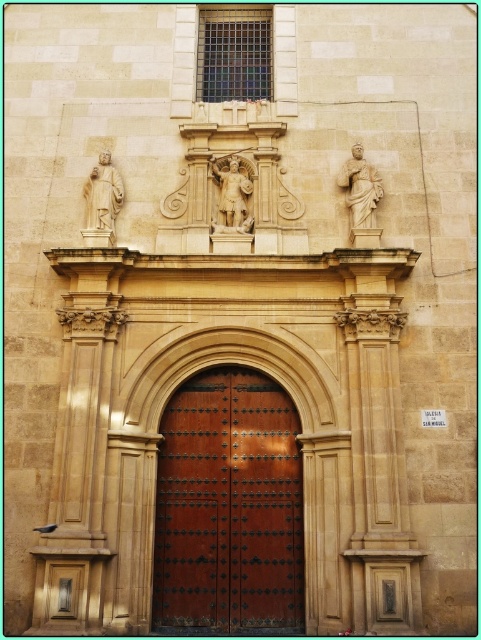
Question: Is brown wooden door at center to the right of light brown stone statue at center from the viewer's perspective?

Choices:
 (A) yes
 (B) no

Answer: (B)

Question: Is brown wooden door at center wider than light brown stone statue at center?

Choices:
 (A) yes
 (B) no

Answer: (A)

Question: Which object is closer to the camera taking this photo?

Choices:
 (A) light brown stone statue at center
 (B) brown wooden door at center
 (C) light beige stone statue at upper left

Answer: (B)

Question: Among these points, which one is nearest to the camera?

Choices:
 (A) (227, 609)
 (B) (361, 209)
 (C) (102, 218)

Answer: (A)

Question: Which is farther from the brown wooden door at center?

Choices:
 (A) light brown stone statue at center
 (B) light beige stone statue at upper left
 (C) white marble statue at center

Answer: (A)

Question: Does brown wooden door at center have a larger size compared to light brown stone statue at center?

Choices:
 (A) no
 (B) yes

Answer: (B)